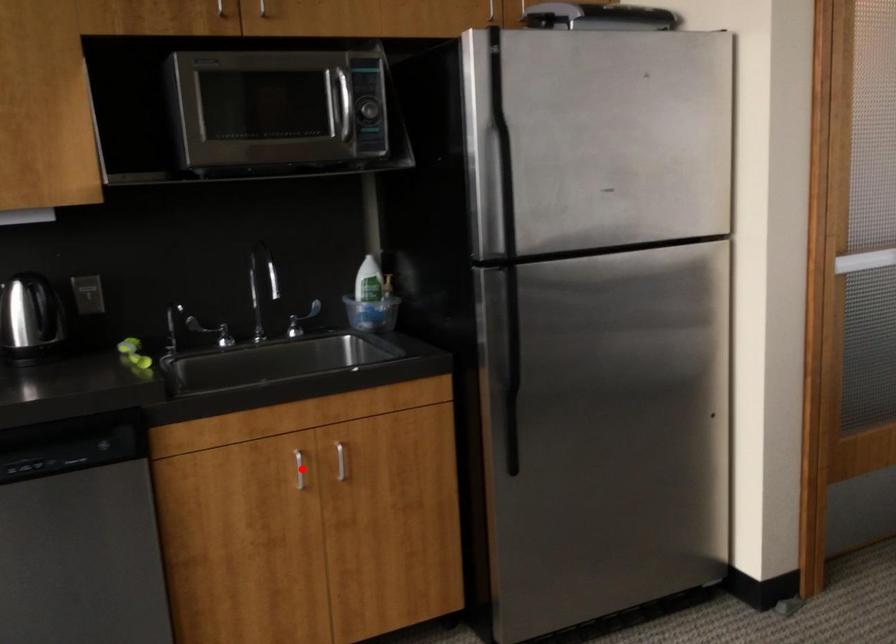
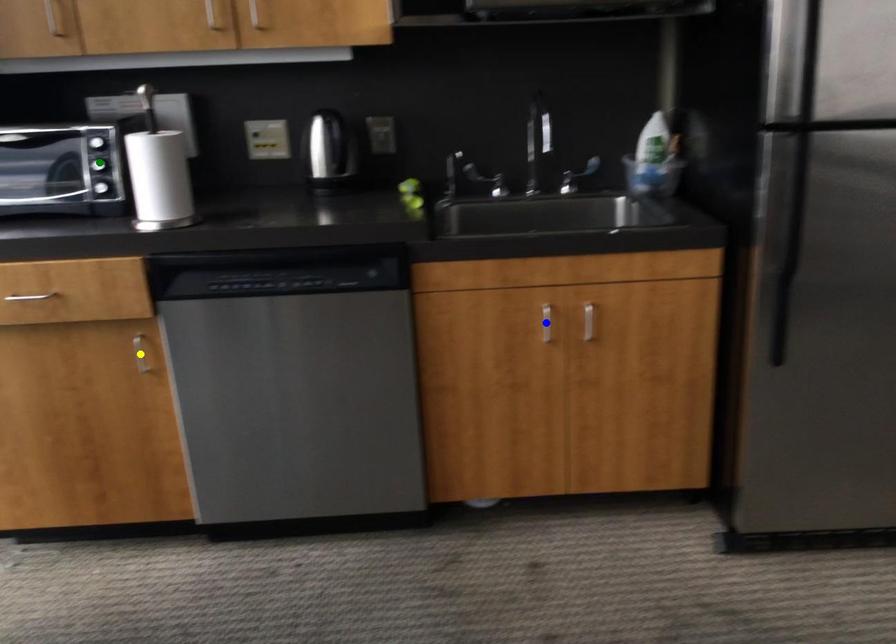
Question: I am providing you with two images of the same scene from different viewpoints. A red point is marked on the first image. You are given multiple points on the second image. In image 2, which mark is for the same physical point as the one in image 1?

Choices:
 (A) green point
 (B) yellow point
 (C) blue point

Answer: (C)